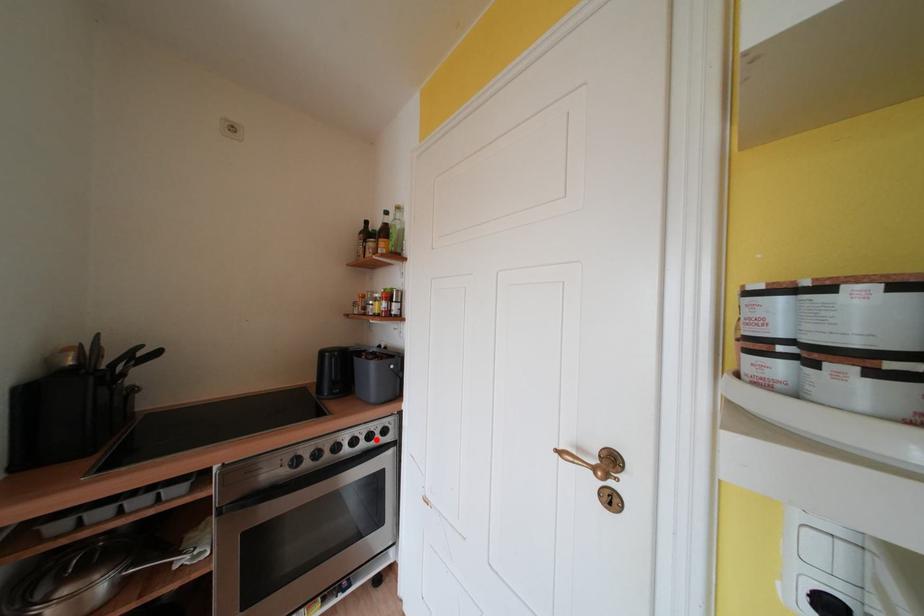
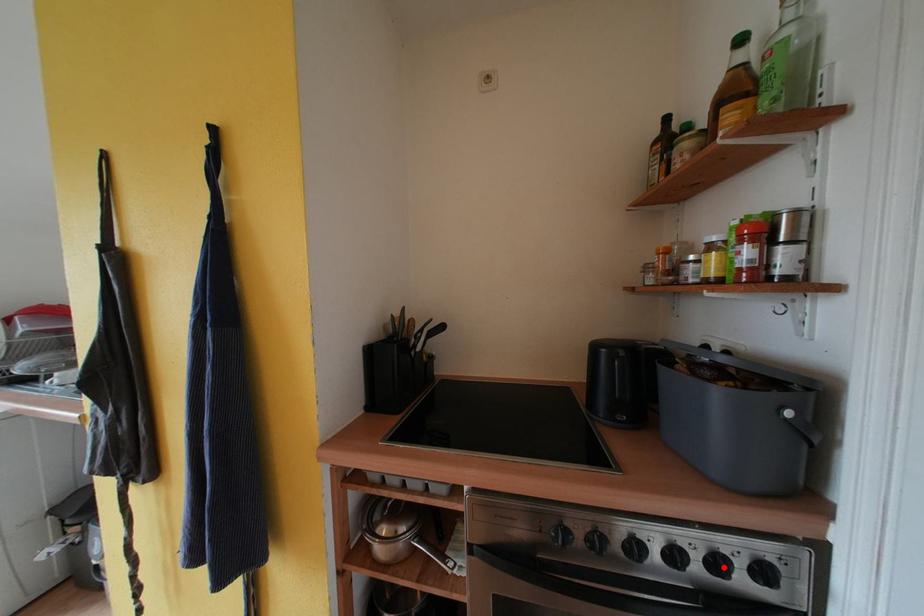
I am providing you with two images of the same scene from different viewpoints. A red point is marked on the first image and another point is marked on the second image. Does the point marked in image1 correspond to the same location as the one in image2?

Yes